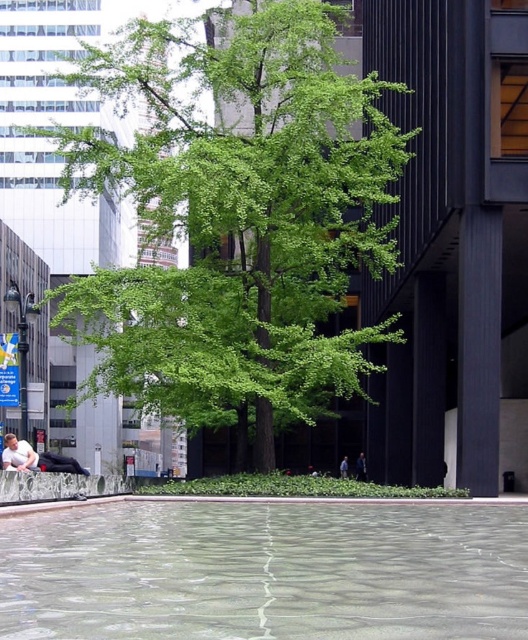
You are standing at the edge of the smooth concrete ledge at lower center and want to look up to see the green leafy tree at center. In which direction should you look?

You should look upwards because the green leafy tree at center is located above the smooth concrete ledge at lower center.